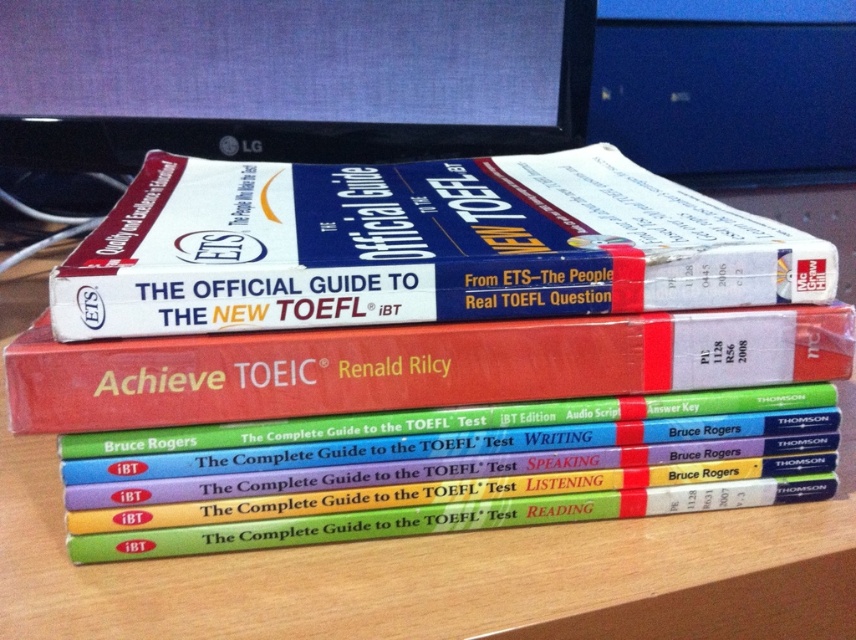
You are organizing a study session and need to place a white paper at upper center and a red matte hardcover book at center on the desk. According to the image, which object is positioned to the left of the other?

The white paper at upper center is to the left of the red matte hardcover book at center.

You are a student preparing for your TOEFL exam and you have both the white paper at upper center and the black glossy monitor at upper center in front of you. Which object is positioned lower on the desk?

The white paper at upper center is positioned below the black glossy monitor at upper center, so the white paper at upper center is lower on the desk.

You are a student trying to place a notebook between the black glossy monitor at upper center and the red matte hardcover book at center. Based on their positions, where should you place the notebook?

The black glossy monitor at upper center is to the left of the red matte hardcover book at center, so you should place the notebook between them on the right side of the monitor and the left side of the book.